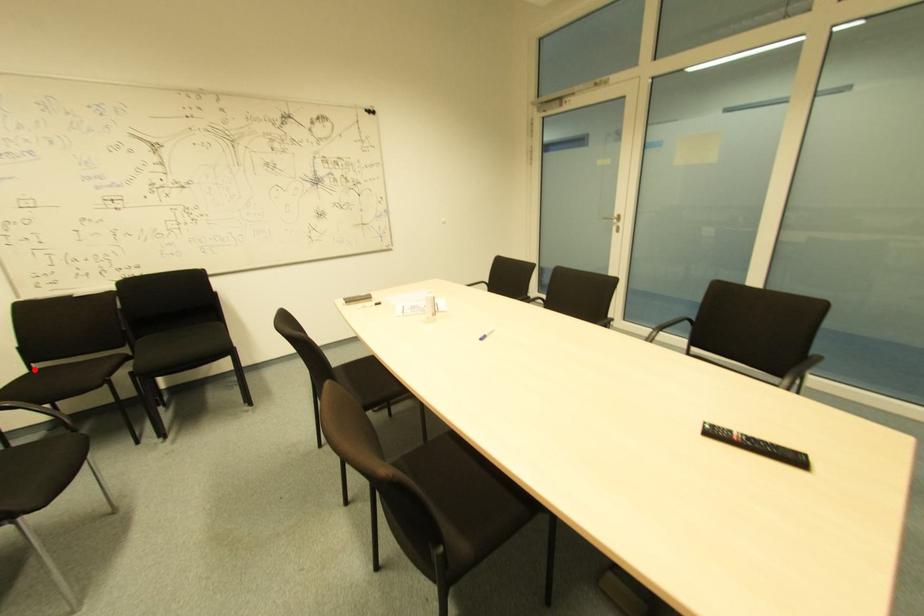
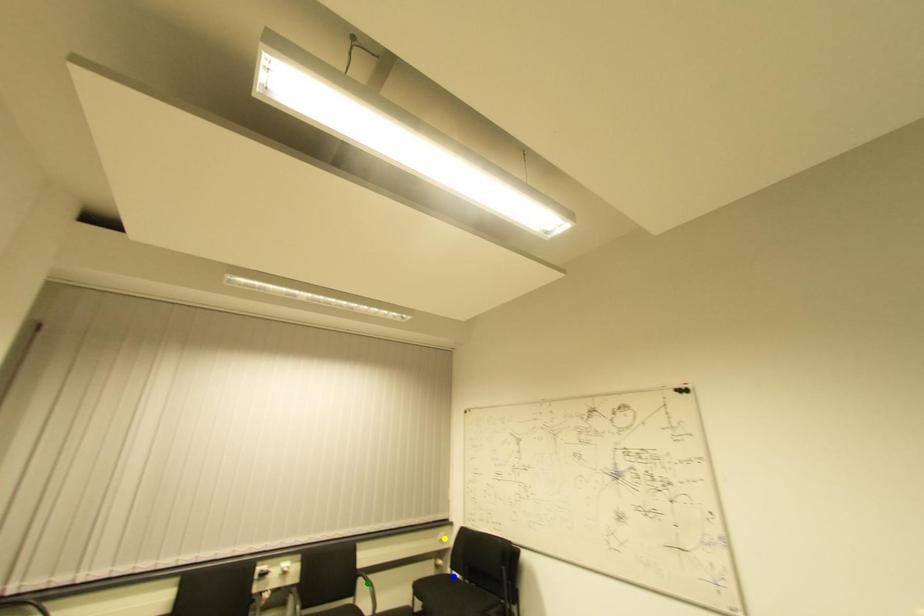
Question: I am providing you with two images of the same scene from different viewpoints. A red point is marked on the first image. You are given multiple points on the second image. Which point in image 2 represents the same 3d spot as the red point in image 1?

Choices:
 (A) yellow point
 (B) green point
 (C) blue point

Answer: (C)